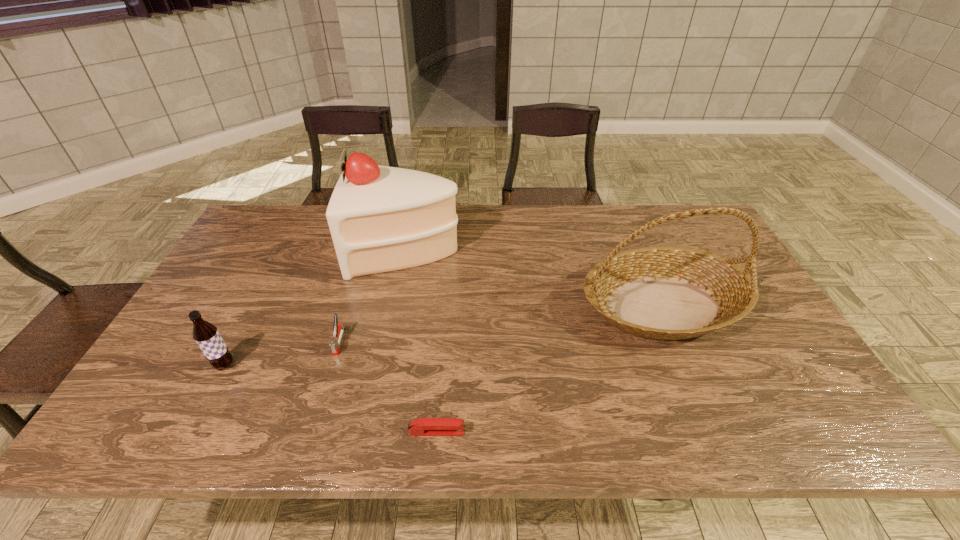
Identify the location of cake. (381, 218).

Identify the location of basket. Image resolution: width=960 pixels, height=540 pixels. (667, 293).

You are a GUI agent. You are given a task and a screenshot of the screen. Output one action in this format:
    pyautogui.click(x=<x>, y=<y>)
    Task: Click on the second nearest object
    Image resolution: width=960 pixels, height=540 pixels.
    Given the screenshot: What is the action you would take?
    pyautogui.click(x=206, y=335)

Where is `the third tallest object`? Image resolution: width=960 pixels, height=540 pixels. the third tallest object is located at coordinates (206, 335).

Identify the location of the farther stapler. (338, 330).

The height and width of the screenshot is (540, 960). Identify the location of the left stapler. 338,330.

Where is `the shorter stapler`? This screenshot has height=540, width=960. the shorter stapler is located at coordinates (423, 426).

You are a GUI agent. You are given a task and a screenshot of the screen. Output one action in this format:
    pyautogui.click(x=<x>, y=<y>)
    Task: Click on the nearer stapler
    This screenshot has width=960, height=540.
    Given the screenshot: What is the action you would take?
    pyautogui.click(x=423, y=426)

The width and height of the screenshot is (960, 540). Find the location of `free spot located on the front of the cake`. free spot located on the front of the cake is located at coordinates (391, 329).

Identify the location of vacant area situated on the front of the basket. (713, 423).